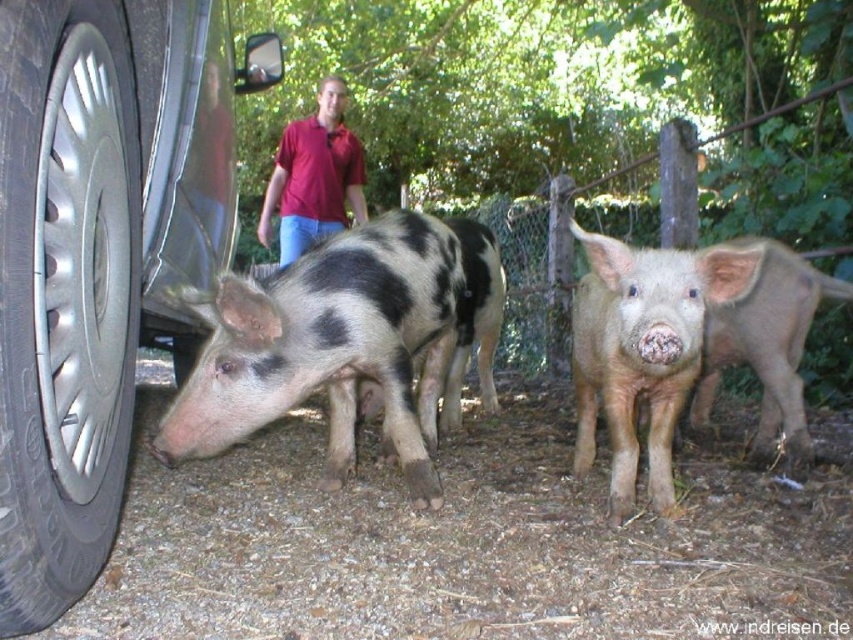
Can you confirm if silver metallic tire at left is taller than light brown furry piglet at center?

Yes, silver metallic tire at left is taller than light brown furry piglet at center.

Between point (155, 45) and point (624, 365), which one is positioned in front?

Positioned in front is point (155, 45).

Measure the distance between silver metallic tire at left and camera.

They are 35.40 inches apart.

Find the location of `silver metallic tire at left`. silver metallic tire at left is located at coordinates (99, 253).

Between point (96, 426) and point (747, 317), which one is positioned in front?

Point (96, 426)

Is brushed metal tire at lower left smaller than light brown fur piglet at center?

Yes, brushed metal tire at lower left is smaller than light brown fur piglet at center.

Is point (27, 64) less distant than point (787, 403)?

Yes, it is.

The height and width of the screenshot is (640, 853). I want to click on brushed metal tire at lower left, so click(x=64, y=298).

Does speckled fur pig at center appear over light brown furry piglet at center?

Incorrect, speckled fur pig at center is not positioned above light brown furry piglet at center.

Looking at this image, between speckled fur pig at center and light brown furry piglet at center, which one has less height?

light brown furry piglet at center

Where is `speckled fur pig at center`? The image size is (853, 640). speckled fur pig at center is located at coordinates (328, 346).